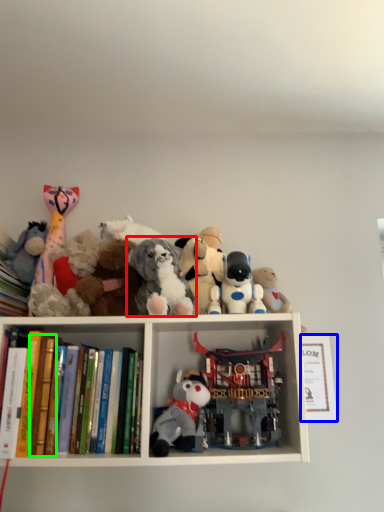
Question: Estimate the real-world distances between objects in this image. Which object is closer to toy (highlighted by a red box), paperback book (highlighted by a blue box) or paperback book (highlighted by a green box)?

Choices:
 (A) paperback book
 (B) paperback book

Answer: (B)